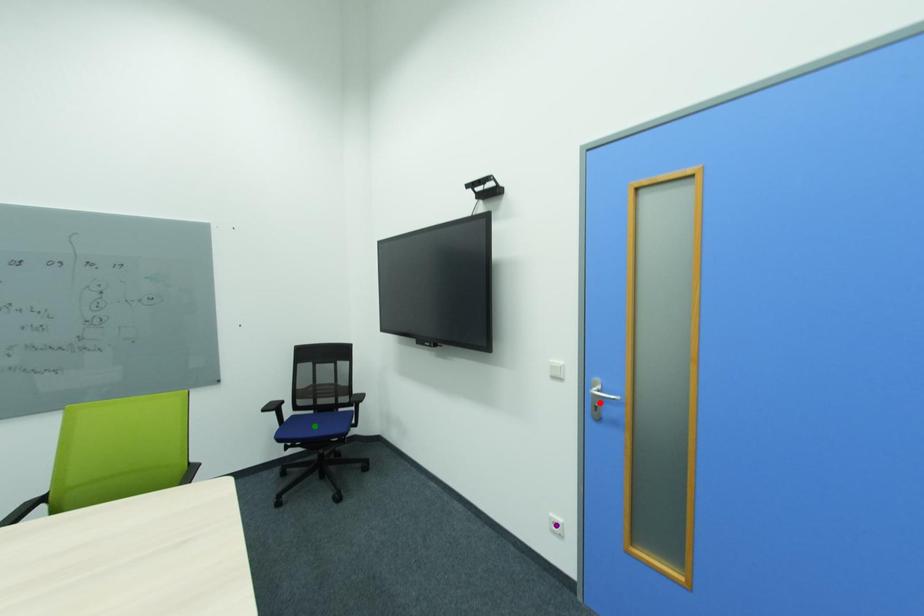
Order these from nearest to farthest:
1. purple point
2. green point
3. red point

1. red point
2. purple point
3. green point